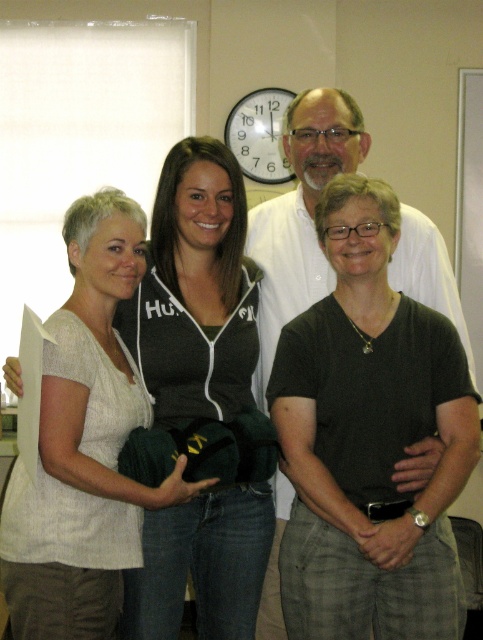
From the picture: Can you confirm if light beige fabric shirt at left is thinner than white matte shirt at upper center?

Indeed, light beige fabric shirt at left has a lesser width compared to white matte shirt at upper center.

Is light beige fabric shirt at left to the right of white matte shirt at upper center from the viewer's perspective?

Incorrect, light beige fabric shirt at left is not on the right side of white matte shirt at upper center.

Which is behind, point (67, 540) or point (274, 589)?

The point (274, 589) is behind.

Where is `light beige fabric shirt at left`? Image resolution: width=483 pixels, height=640 pixels. light beige fabric shirt at left is located at coordinates (84, 444).

Is the position of white matte shirt at upper center more distant than that of white plastic clock at upper center?

No.

This screenshot has height=640, width=483. In order to click on white matte shirt at upper center in this screenshot , I will do `click(301, 211)`.

Can you confirm if light beige fabric shirt at left is bigger than white plastic clock at upper center?

Correct, light beige fabric shirt at left is larger in size than white plastic clock at upper center.

Measure the distance between light beige fabric shirt at left and camera.

1.64 meters

At what (x,y) coordinates should I click in order to perform the action: click on light beige fabric shirt at left. Please return your answer as a coordinate pair (x, y). This screenshot has width=483, height=640. Looking at the image, I should click on [84, 444].